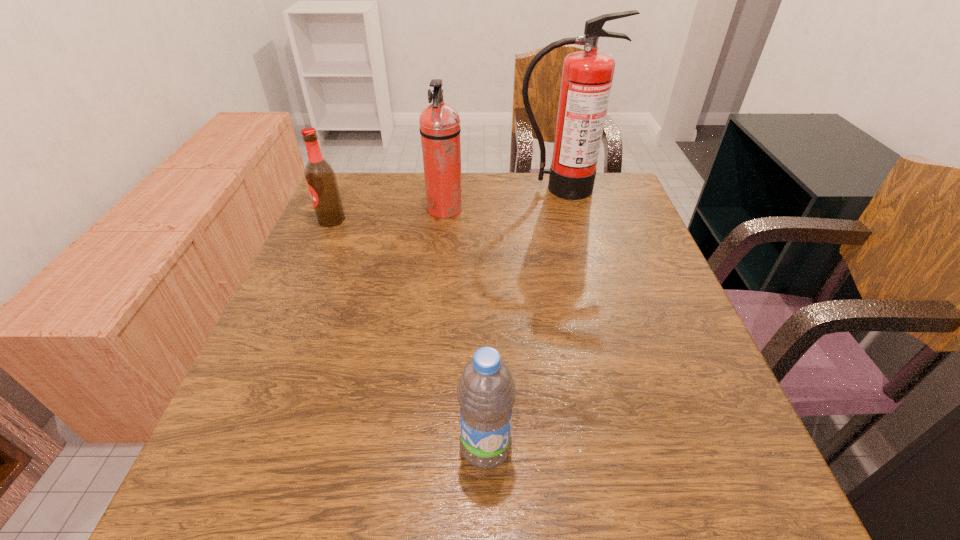
Identify the location of the right fire extinguisher. This screenshot has width=960, height=540. (587, 75).

Find the location of `the taller fire extinguisher`. the taller fire extinguisher is located at coordinates pyautogui.click(x=587, y=75).

This screenshot has width=960, height=540. I want to click on the third shortest object, so click(440, 129).

Find the location of `the shorter fire extinguisher`. the shorter fire extinguisher is located at coordinates (440, 129).

The height and width of the screenshot is (540, 960). I want to click on beer bottle, so click(x=321, y=180).

I want to click on the second object from right to left, so click(x=486, y=392).

Where is `water bottle`? This screenshot has width=960, height=540. water bottle is located at coordinates (486, 392).

You are a GUI agent. You are given a task and a screenshot of the screen. Output one action in this format:
    pyautogui.click(x=<x>, y=<y>)
    Task: Click on the vacant space located on the front-facing side of the taller fire extinguisher
    This screenshot has width=960, height=540.
    Given the screenshot: What is the action you would take?
    pyautogui.click(x=574, y=246)

Locate an element on the screen. The image size is (960, 540). free region located 0.400m at the nozzle of the shorter fire extinguisher is located at coordinates (608, 210).

Where is `free space located on the front of the leftmost object`? free space located on the front of the leftmost object is located at coordinates (300, 292).